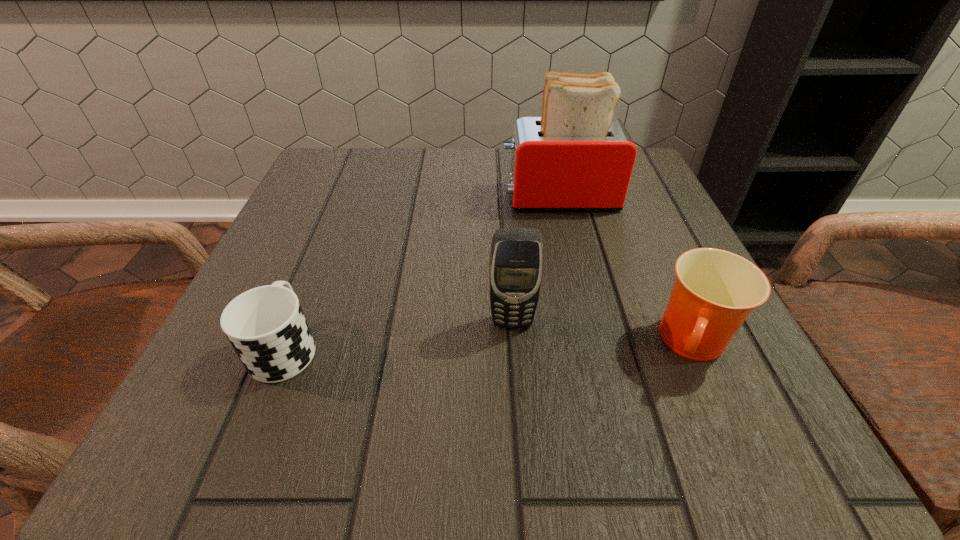
This screenshot has height=540, width=960. In order to click on vacant point that satisfies the following two spatial constraints: 1. on the front face of the third tallest object; 2. on the right side of the cellular telephone in this screenshot , I will do `click(514, 345)`.

This screenshot has height=540, width=960. In order to click on vacant space that satisfies the following two spatial constraints: 1. on the side of the shortest object with the handle; 2. on the left side of the right cup in this screenshot , I will do `click(286, 345)`.

Identify the location of vacant area in the image that satisfies the following two spatial constraints: 1. on the side of the shorter cup with the handle; 2. on the right side of the second shortest object. The height and width of the screenshot is (540, 960). 286,345.

Find the location of a particular element. The width and height of the screenshot is (960, 540). vacant space that satisfies the following two spatial constraints: 1. on the side of the second shortest object with the handle; 2. on the right side of the left cup is located at coordinates (286, 345).